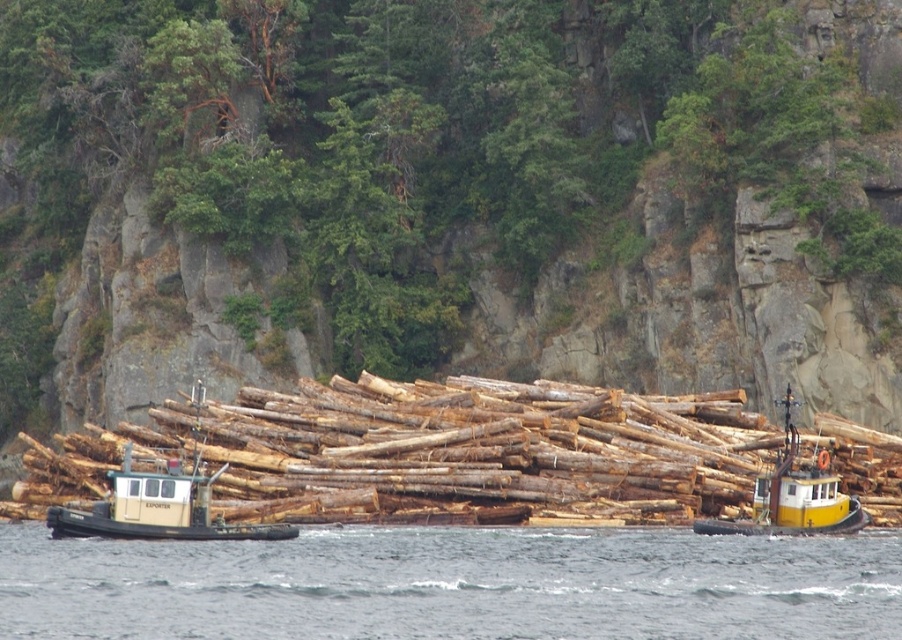
Question: Is green leafy tree at center to the left of beige rubber tugboat at left from the viewer's perspective?

Choices:
 (A) no
 (B) yes

Answer: (A)

Question: Is beige rubber tugboat at left above yellow matte tugboat at center?

Choices:
 (A) yes
 (B) no

Answer: (B)

Question: Which point is closer to the camera taking this photo?

Choices:
 (A) (104, 532)
 (B) (790, 499)
 (C) (5, 323)
 (D) (513, 600)

Answer: (D)

Question: Does green leafy tree at center appear on the left side of beige rubber tugboat at left?

Choices:
 (A) no
 (B) yes

Answer: (A)

Question: Which point is closer to the camera taking this photo?

Choices:
 (A) (345, 40)
 (B) (864, 540)

Answer: (B)

Question: Which of the following is the farthest from the observer?

Choices:
 (A) beige rubber tugboat at left
 (B) green leafy tree at center

Answer: (B)